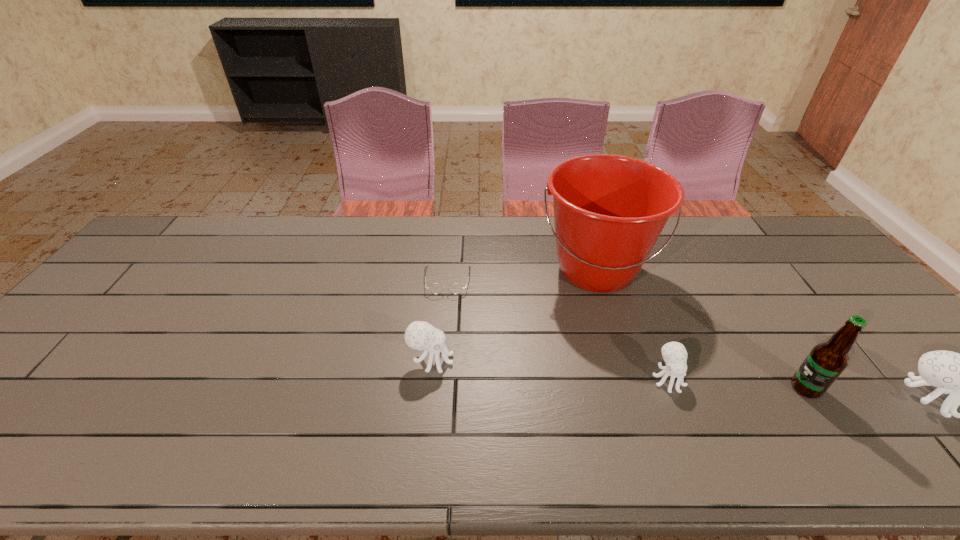
In order to click on free space located 0.200m through the lenses of the shortest object in this screenshot , I will do `click(442, 348)`.

Where is `free space located 0.310m with the handle attached to the rim of the tallest object`? free space located 0.310m with the handle attached to the rim of the tallest object is located at coordinates (638, 408).

I want to click on free point located on the label of the beer bottle, so click(x=698, y=388).

At what (x,y) coordinates should I click in order to perform the action: click on free space located on the label of the beer bottle. Please return your answer as a coordinate pair (x, y). Looking at the image, I should click on (724, 388).

The height and width of the screenshot is (540, 960). I want to click on vacant space located 0.210m on the label of the beer bottle, so click(x=703, y=388).

The height and width of the screenshot is (540, 960). I want to click on object situated at the far edge, so click(609, 211).

Identify the location of octopus that is at the near edge. Image resolution: width=960 pixels, height=540 pixels. (674, 354).

Locate an element on the screen. The image size is (960, 540). beer bottle positioned at the near edge is located at coordinates (826, 361).

Where is `free space at the far edge of the desktop`? The image size is (960, 540). free space at the far edge of the desktop is located at coordinates (465, 226).

The width and height of the screenshot is (960, 540). I want to click on vacant space at the near edge of the desktop, so click(449, 395).